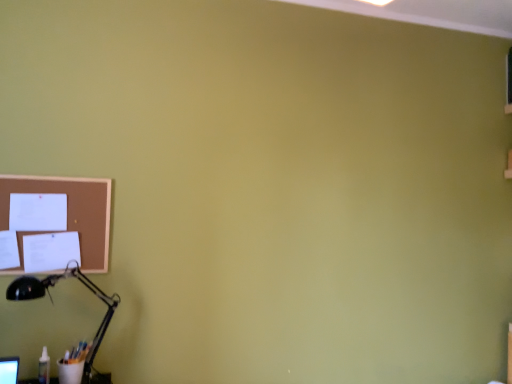
Identify the location of black matte desk lamp at lower left. (52, 302).

Describe the element at coordinates (52, 302) in the screenshot. I see `black matte desk lamp at lower left` at that location.

You are a GUI agent. You are given a task and a screenshot of the screen. Output one action in this format:
    pyautogui.click(x=<x>, y=<y>)
    Task: Click on the brown corkboard at upper left
    The image size is (512, 384).
    Given the screenshot: What is the action you would take?
    pyautogui.click(x=71, y=211)

What do you see at coordinates (71, 211) in the screenshot? This screenshot has width=512, height=384. I see `brown corkboard at upper left` at bounding box center [71, 211].

In order to face brown corkboard at upper left, should I rotate leftwards or rightwards?

To face it directly, rotate left by 24.930 degrees.

Where is `black matte desk lamp at lower left`? black matte desk lamp at lower left is located at coordinates (52, 302).

Considering the positions of objects brown corkboard at upper left and black matte desk lamp at lower left in the image provided, who is more to the right, brown corkboard at upper left or black matte desk lamp at lower left?

black matte desk lamp at lower left.

Considering the positions of objects brown corkboard at upper left and black matte desk lamp at lower left in the image provided, who is behind, brown corkboard at upper left or black matte desk lamp at lower left?

brown corkboard at upper left.

Is point (72, 197) in front of point (88, 281)?

That is True.

From the image's perspective, is brown corkboard at upper left located beneath black matte desk lamp at lower left?

Incorrect, from the image's perspective, brown corkboard at upper left is higher than black matte desk lamp at lower left.

From a real-world perspective, is brown corkboard at upper left over black matte desk lamp at lower left?

Yes, from a real-world perspective, brown corkboard at upper left is above black matte desk lamp at lower left.

Is brown corkboard at upper left wider than black matte desk lamp at lower left?

Incorrect, the width of brown corkboard at upper left does not surpass that of black matte desk lamp at lower left.

Is brown corkboard at upper left taller than black matte desk lamp at lower left?

In fact, brown corkboard at upper left may be shorter than black matte desk lamp at lower left.

Who is bigger, brown corkboard at upper left or black matte desk lamp at lower left?

With larger size is black matte desk lamp at lower left.

Do you think brown corkboard at upper left is within black matte desk lamp at lower left, or outside of it?

brown corkboard at upper left is not inside black matte desk lamp at lower left, it's outside.

Is brown corkboard at upper left touching black matte desk lamp at lower left?

brown corkboard at upper left and black matte desk lamp at lower left are clearly separated.

Is brown corkboard at upper left turned away from black matte desk lamp at lower left?

brown corkboard at upper left is not turned away from black matte desk lamp at lower left.

The image size is (512, 384). Find the location of `bulletin board on the left of the black matte desk lamp at lower left`. bulletin board on the left of the black matte desk lamp at lower left is located at coordinates click(71, 211).

Is black matte desk lamp at lower left to the left of brown corkboard at upper left from the viewer's perspective?

Incorrect, black matte desk lamp at lower left is not on the left side of brown corkboard at upper left.

Is the position of black matte desk lamp at lower left less distant than that of brown corkboard at upper left?

Yes, it is.

Is point (22, 290) closer to camera compared to point (90, 246)?

Yes, point (22, 290) is in front of point (90, 246).

From the image's perspective, between black matte desk lamp at lower left and brown corkboard at upper left, who is located below?

From the image's view, black matte desk lamp at lower left is below.

From a real-world perspective, between black matte desk lamp at lower left and brown corkboard at upper left, who is vertically lower?

black matte desk lamp at lower left.

Considering the sizes of black matte desk lamp at lower left and brown corkboard at upper left in the image, is black matte desk lamp at lower left wider or thinner than brown corkboard at upper left?

In the image, black matte desk lamp at lower left appears to be wider than brown corkboard at upper left.

Considering the relative sizes of black matte desk lamp at lower left and brown corkboard at upper left in the image provided, is black matte desk lamp at lower left shorter than brown corkboard at upper left?

In fact, black matte desk lamp at lower left may be taller than brown corkboard at upper left.

Does black matte desk lamp at lower left have a smaller size compared to brown corkboard at upper left?

Actually, black matte desk lamp at lower left might be larger than brown corkboard at upper left.

Would you say black matte desk lamp at lower left contains brown corkboard at upper left?

No, brown corkboard at upper left is located outside of black matte desk lamp at lower left.

Is black matte desk lamp at lower left touching brown corkboard at upper left?

No, black matte desk lamp at lower left is not beside brown corkboard at upper left.

Could you tell me if black matte desk lamp at lower left is turned towards brown corkboard at upper left?

No, black matte desk lamp at lower left does not turn towards brown corkboard at upper left.

What's the angular difference between black matte desk lamp at lower left and brown corkboard at upper left's facing directions?

The angular difference between black matte desk lamp at lower left and brown corkboard at upper left is 0.799 degrees.

Where is `lamp located below the brown corkboard at upper left (from the image's perspective)`? This screenshot has height=384, width=512. lamp located below the brown corkboard at upper left (from the image's perspective) is located at coordinates (52, 302).

The image size is (512, 384). What are the coordinates of `lamp that is in front of the brown corkboard at upper left` in the screenshot? It's located at (52, 302).

Find the location of `lamp that appears below the brown corkboard at upper left (from a real-world perspective)`. lamp that appears below the brown corkboard at upper left (from a real-world perspective) is located at coordinates (52, 302).